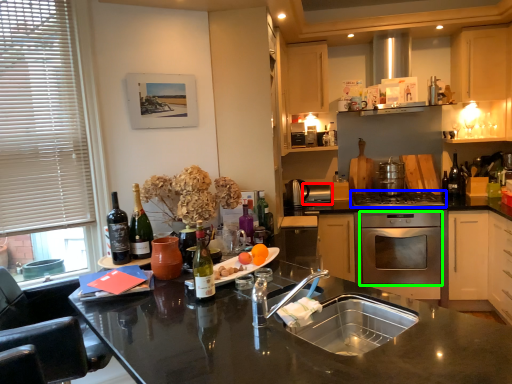
Question: Considering the real-world distances, which object is closest to appliance (highlighted by a red box)? gas stove (highlighted by a blue box) or oven (highlighted by a green box).

Choices:
 (A) gas stove
 (B) oven

Answer: (A)